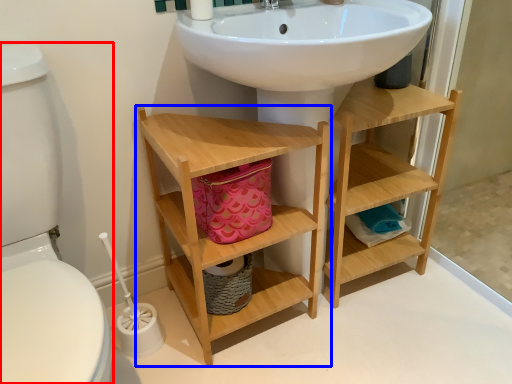
Question: Which of the following is the farthest to the observer, toilet bowl (highlighted by a red box) or bathroom cabinet (highlighted by a blue box)?

Choices:
 (A) toilet bowl
 (B) bathroom cabinet

Answer: (B)